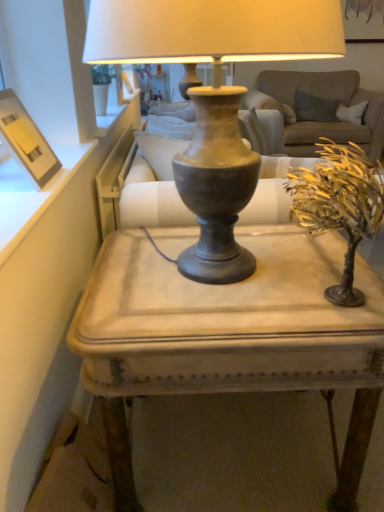
At what (x,y) coordinates should I click in order to perform the action: click on free space to the left of gold textured tree at right. Please return your answer as a coordinate pair (x, y). This screenshot has width=384, height=512. Looking at the image, I should click on (211, 295).